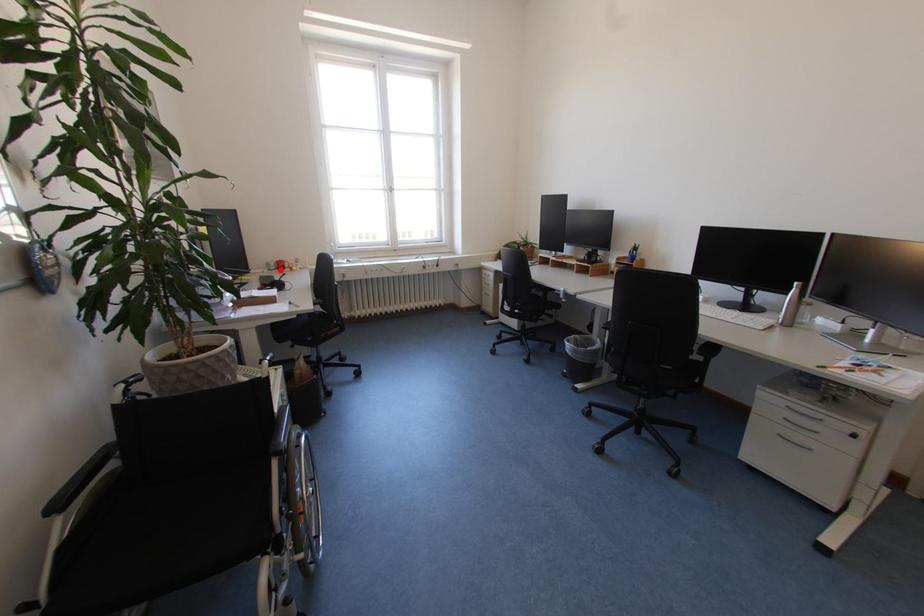
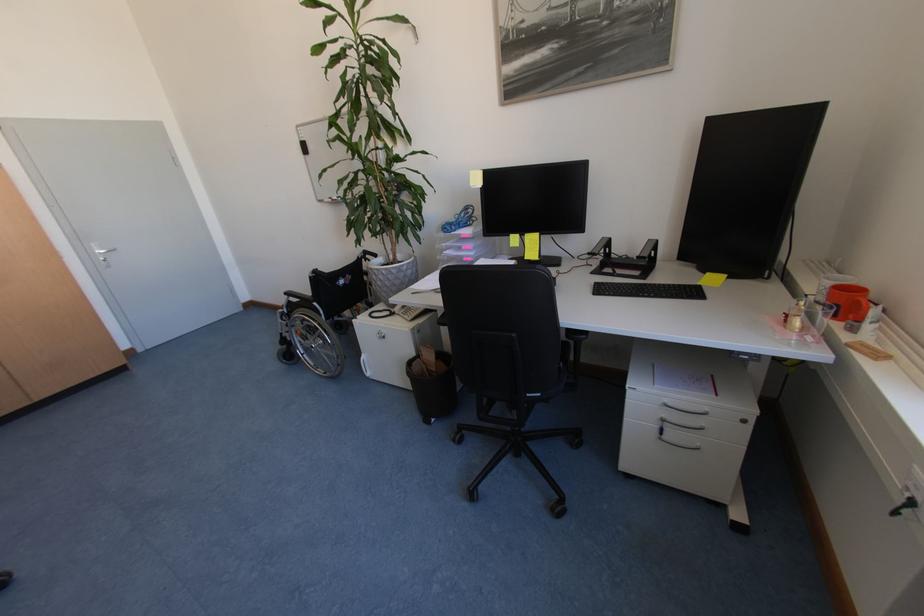
Where in the second image is the point corresponding to the highlighted location from the first image?

(824, 300)